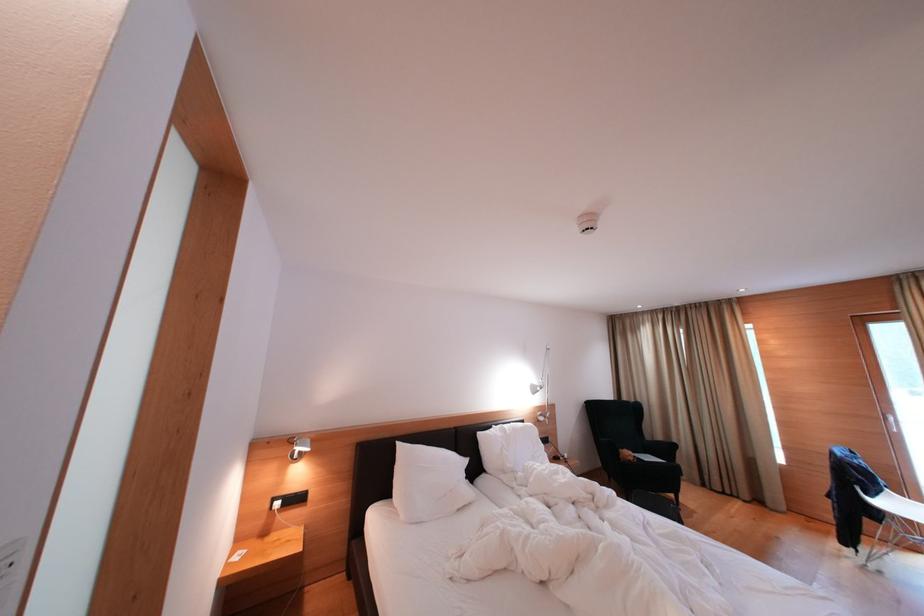
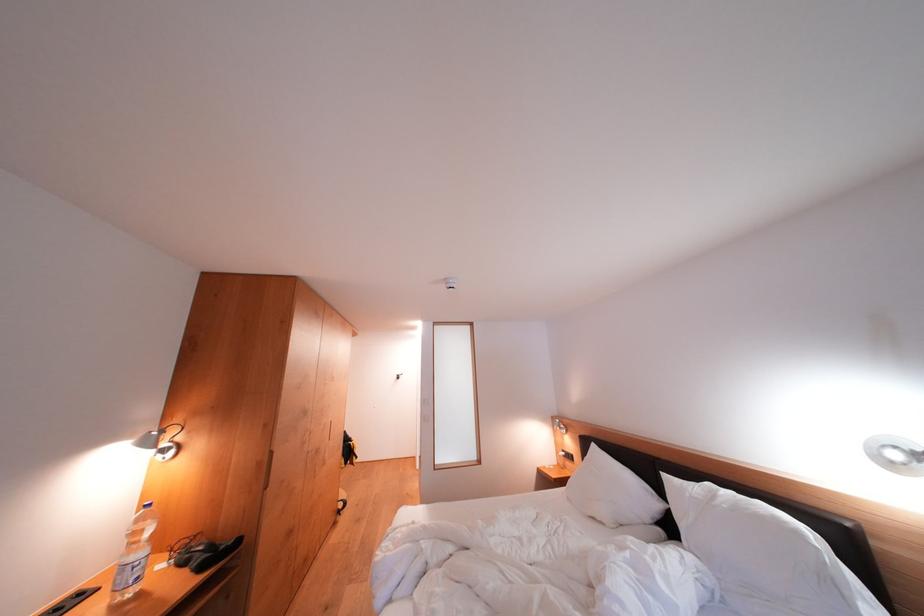
The point at (x=472, y=466) is marked in the first image. Where is the corresponding point in the second image?

(664, 509)